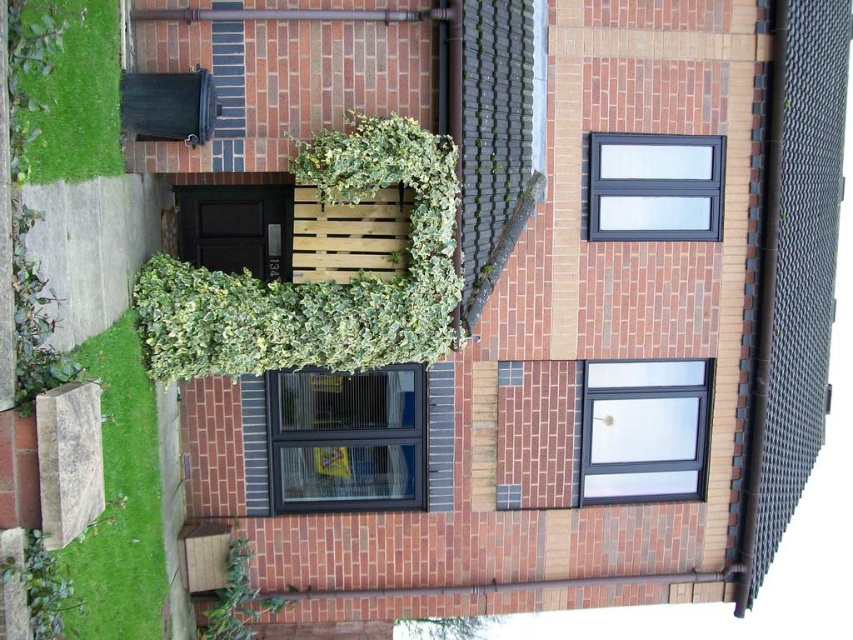
You are standing in front of the house and see two green leafy plants. One is labeled as green leafy plant at center and the other as green leafy plant at lower center. Which one is positioned to the right of the other?

The green leafy plant at center is positioned to the right of the green leafy plant at lower center.